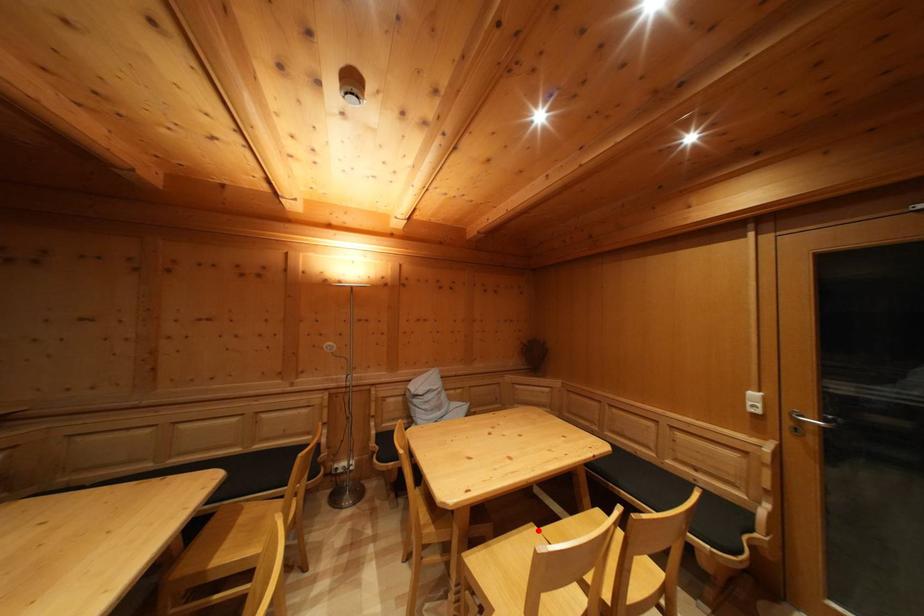
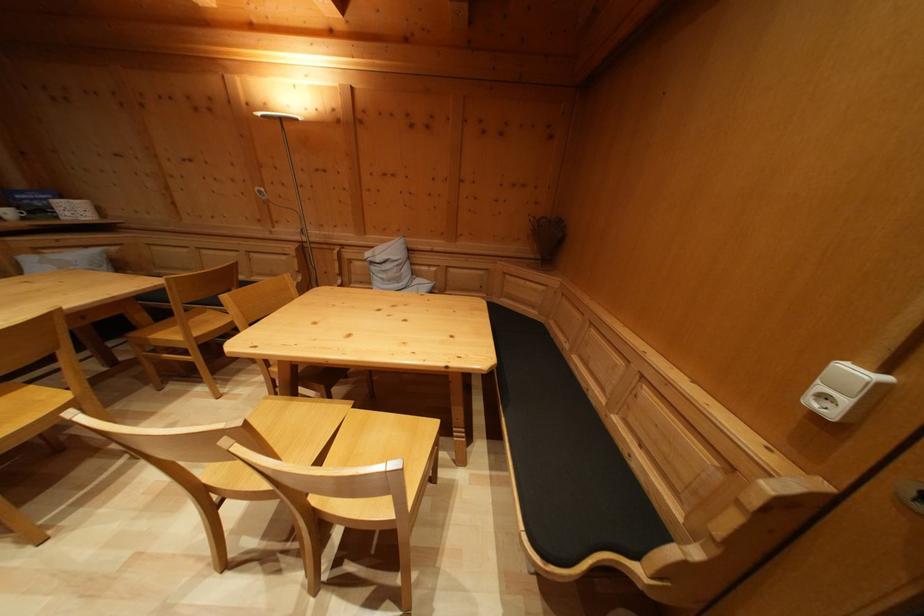
Question: I am providing you with two images of the same scene from different viewpoints. Image1 has a red point marked. In image2, the corresponding 3D location appears at what relative position? Reply with the corresponding letter.

Choices:
 (A) Closer
 (B) Farther

Answer: (B)